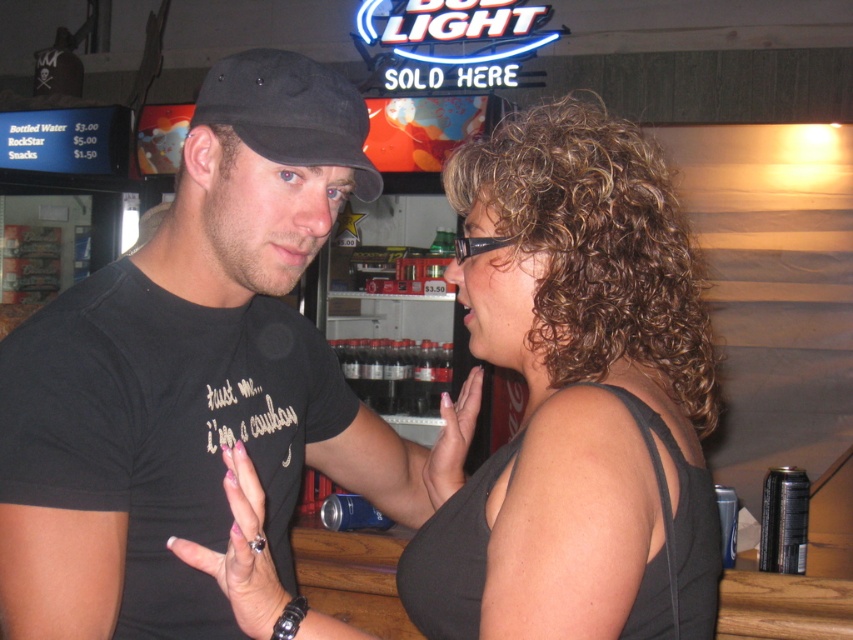
You are a bartender who needs to place both the dark glass bottles at center and the pink nail polish at center on a narrow shelf. Which item should you place first to ensure they both fit?

The dark glass bottles at center are wider than the pink nail polish at center, so place the pink nail polish at center first to accommodate the wider bottle next.